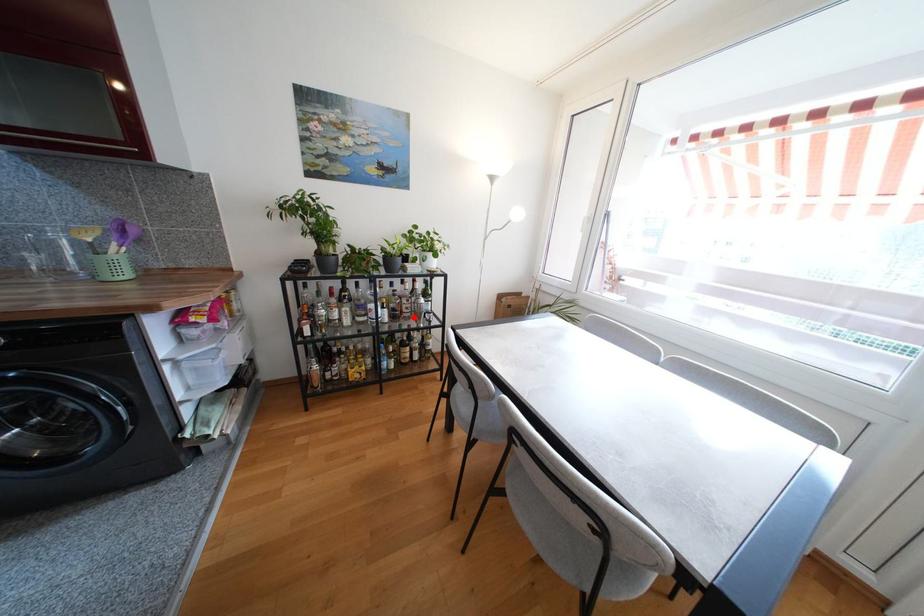
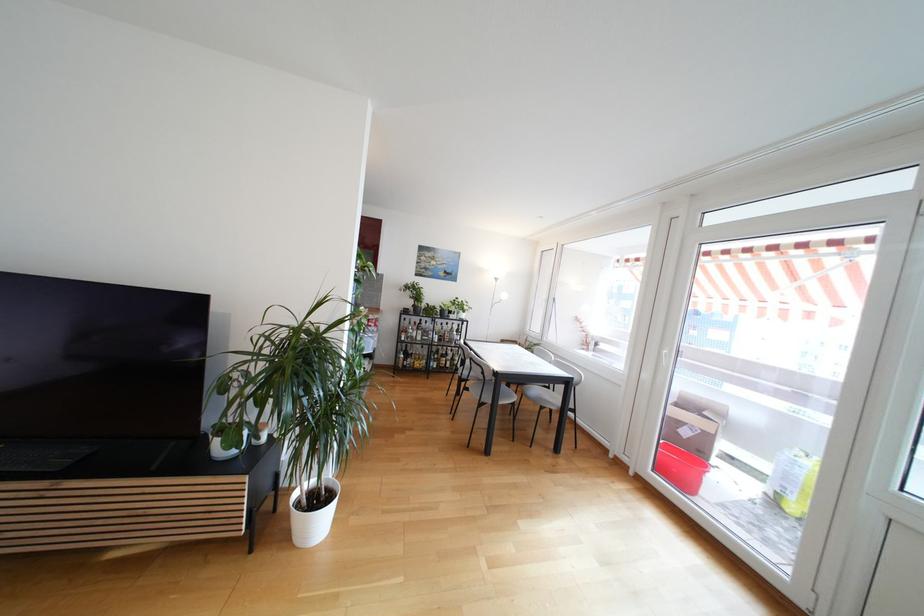
In the second image, find the point that corresponds to the highlighted location in the first image.

(453, 342)